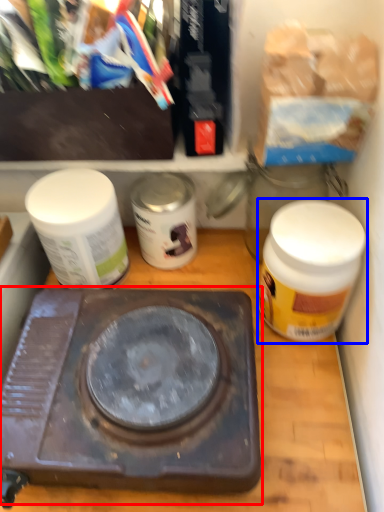
Question: Among these objects, which one is farthest to the camera, stove (highlighted by a red box) or bottle (highlighted by a blue box)?

Choices:
 (A) stove
 (B) bottle

Answer: (B)